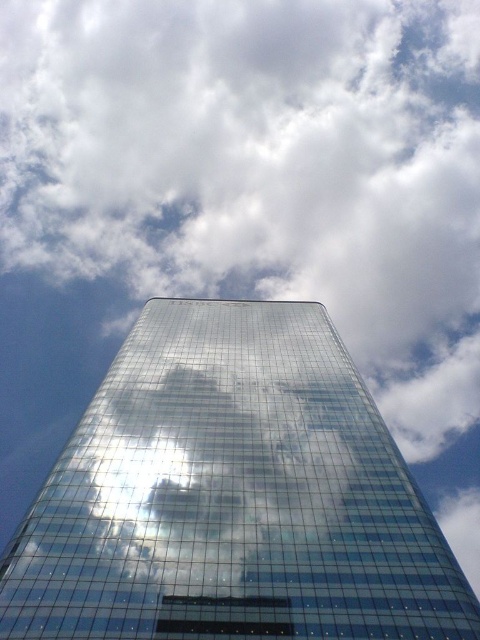
Can you confirm if transparent glass tower at center is taller than transparent glass building at center?

Indeed, transparent glass tower at center has a greater height compared to transparent glass building at center.

The image size is (480, 640). Identify the location of transparent glass tower at center. (231, 497).

Locate an element on the screen. The image size is (480, 640). transparent glass tower at center is located at coordinates (231, 497).